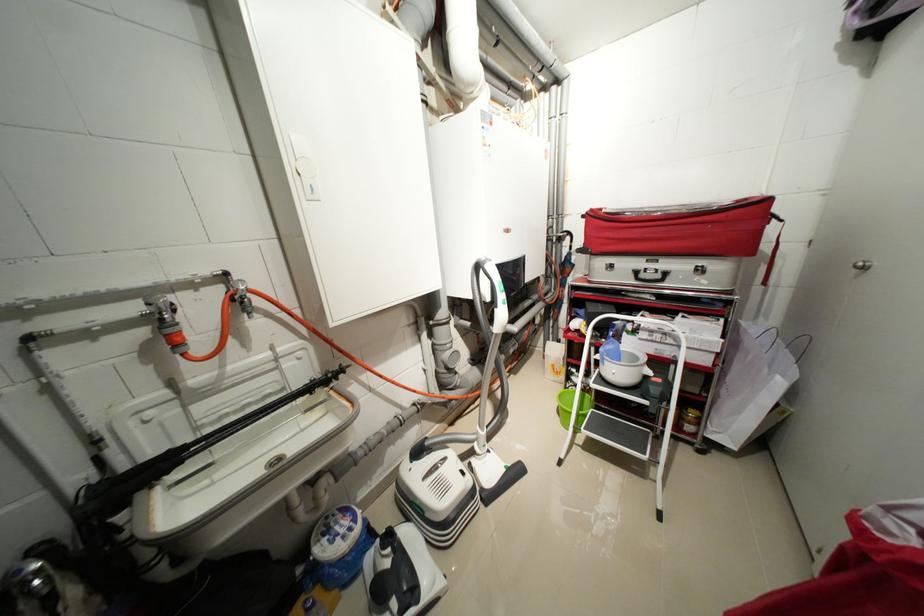
This screenshot has width=924, height=616. I want to click on white paper bag, so click(748, 384).